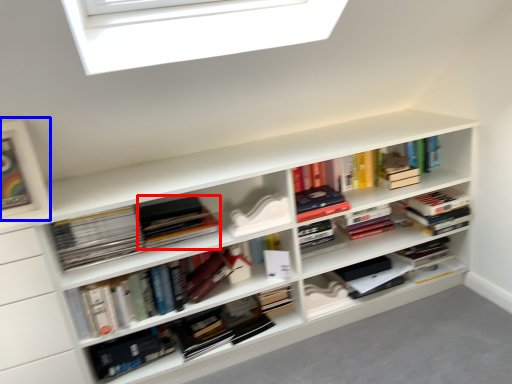
Question: Which point is closer to the camera, book (highlighted by a red box) or picture frame (highlighted by a blue box)?

Choices:
 (A) book
 (B) picture frame

Answer: (B)